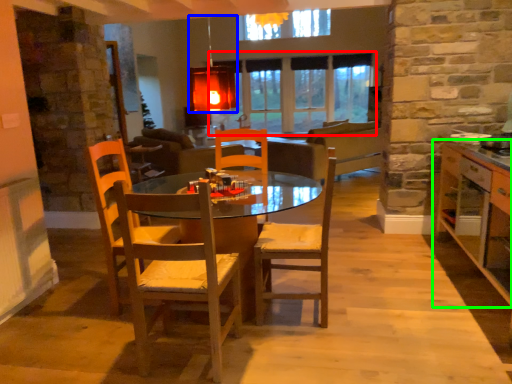
Question: Estimate the real-world distances between objects in this image. Which object is farther from window (highlighted by a red box), light fixture (highlighted by a blue box) or cabinetry (highlighted by a green box)?

Choices:
 (A) light fixture
 (B) cabinetry

Answer: (A)